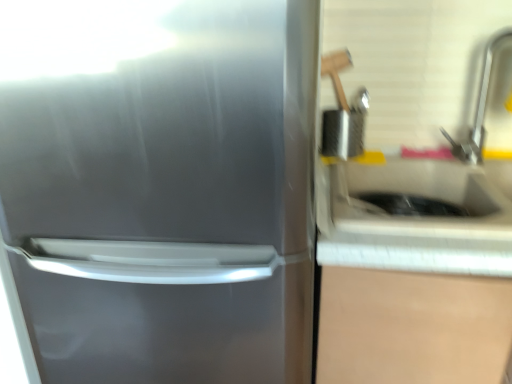
Question: Considering the relative sizes of white glossy sink at right and satin silver refrigerator at left in the image provided, is white glossy sink at right taller than satin silver refrigerator at left?

Choices:
 (A) no
 (B) yes

Answer: (A)

Question: Does white glossy sink at right come behind satin silver refrigerator at left?

Choices:
 (A) yes
 (B) no

Answer: (A)

Question: Does white glossy sink at right appear on the left side of satin silver refrigerator at left?

Choices:
 (A) no
 (B) yes

Answer: (A)

Question: Does white glossy sink at right touch satin silver refrigerator at left?

Choices:
 (A) no
 (B) yes

Answer: (A)

Question: From a real-world perspective, is white glossy sink at right on top of satin silver refrigerator at left?

Choices:
 (A) no
 (B) yes

Answer: (B)

Question: From the image's perspective, is white glossy sink at right located beneath satin silver refrigerator at left?

Choices:
 (A) no
 (B) yes

Answer: (A)

Question: Does satin nickel faucet at upper right have a smaller size compared to satin silver refrigerator at left?

Choices:
 (A) yes
 (B) no

Answer: (A)

Question: From the image's perspective, does satin nickel faucet at upper right appear lower than satin silver refrigerator at left?

Choices:
 (A) yes
 (B) no

Answer: (B)

Question: Can you confirm if satin nickel faucet at upper right is positioned to the right of satin silver refrigerator at left?

Choices:
 (A) no
 (B) yes

Answer: (B)

Question: Is the depth of satin nickel faucet at upper right less than that of satin silver refrigerator at left?

Choices:
 (A) yes
 (B) no

Answer: (B)

Question: Is satin nickel faucet at upper right bigger than satin silver refrigerator at left?

Choices:
 (A) yes
 (B) no

Answer: (B)

Question: Is satin nickel faucet at upper right positioned behind satin silver refrigerator at left?

Choices:
 (A) no
 (B) yes

Answer: (B)

Question: Is satin silver refrigerator at left further to camera compared to satin nickel faucet at upper right?

Choices:
 (A) no
 (B) yes

Answer: (A)